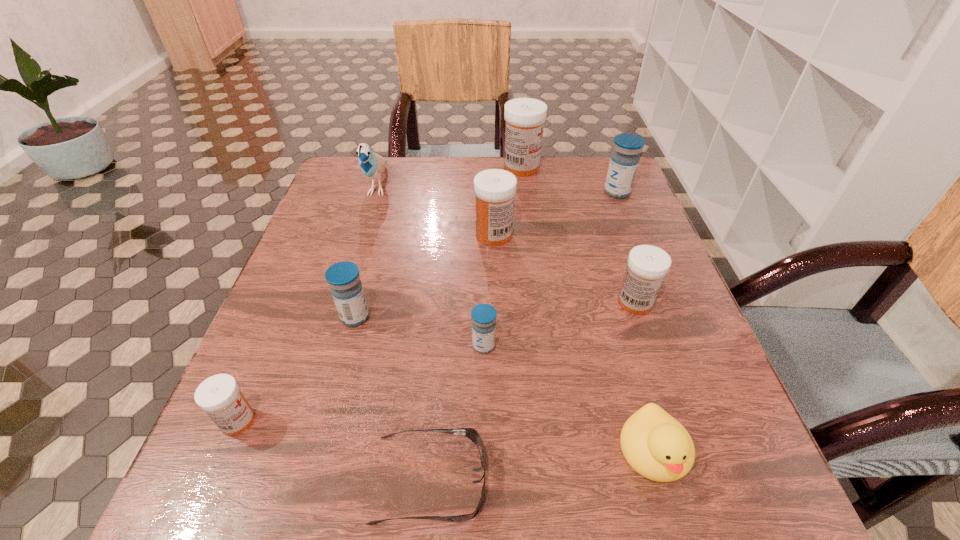
I want to click on free spot between the leftmost blue medicine and the second farthest white medicine, so click(x=424, y=276).

You are a GUI agent. You are given a task and a screenshot of the screen. Output one action in this format:
    pyautogui.click(x=<x>, y=<y>)
    Task: Click on the free spot between the duckling and the third smallest white medicine
    This screenshot has height=540, width=960.
    Given the screenshot: What is the action you would take?
    pyautogui.click(x=574, y=343)

Find the location of a particular element. This screenshot has height=540, width=960. blank region between the nearest medicine and the farthest blue medicine is located at coordinates (427, 306).

At what (x,y) coordinates should I click in order to perform the action: click on free space between the shortest object and the third nearest white medicine. Please return your answer as a coordinate pair (x, y). The image size is (960, 540). Looking at the image, I should click on (462, 357).

Locate an element on the screen. This screenshot has width=960, height=540. vacant region between the smallest blue medicine and the fifth nearest medicine is located at coordinates (489, 290).

Where is `blank region between the second smallest white medicine and the blue bird`? The height and width of the screenshot is (540, 960). blank region between the second smallest white medicine and the blue bird is located at coordinates (507, 244).

Where is `vacant space that is in between the bird and the third farthest white medicine`? vacant space that is in between the bird and the third farthest white medicine is located at coordinates (507, 244).

Find the location of a particular element. blank region between the sunglasses and the blue bird is located at coordinates (404, 333).

The image size is (960, 540). In order to click on free space between the yellow duckling and the nearest white medicine in this screenshot , I will do `click(446, 436)`.

Identify which object is the nearest to the third nearest white medicine. Please provide its 2D coordinates. Your answer should be formatted as a tuple, i.e. [(x, y)], where the tuple contains the x and y coordinates of a point satisfying the conditions above.

[(525, 117)]